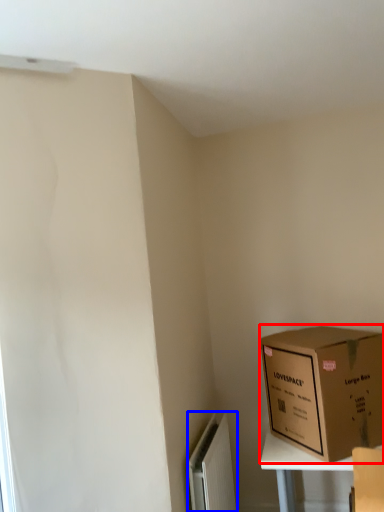
Question: Among these objects, which one is farthest to the camera, box (highlighted by a red box) or radiator (highlighted by a blue box)?

Choices:
 (A) box
 (B) radiator

Answer: (A)